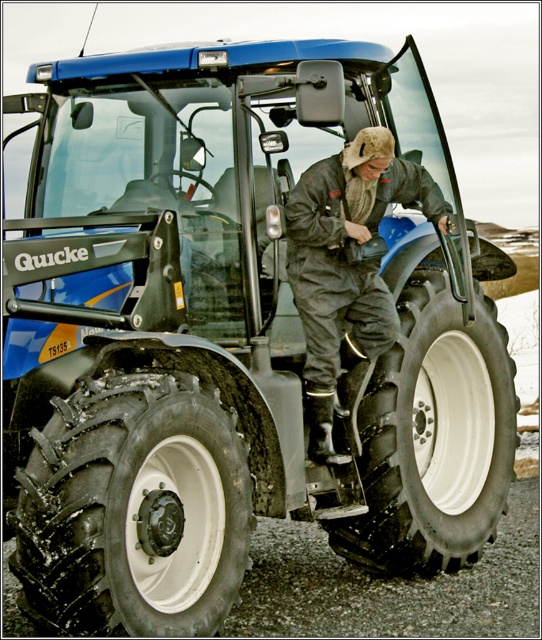
Consider the image. Who is lower down, black rubber tire at lower left or dark gray/leather jacket at center?

black rubber tire at lower left is lower down.

Which of these two, black rubber tire at lower left or dark gray/leather jacket at center, stands shorter?

black rubber tire at lower left is shorter.

Does point (229, 550) lie in front of point (340, 316)?

Yes.

Where is `black rubber tire at lower left`? This screenshot has height=640, width=542. black rubber tire at lower left is located at coordinates (133, 509).

Does black rubber tire at lower left have a smaller size compared to black rubber tire at lower center?

Yes, black rubber tire at lower left is smaller than black rubber tire at lower center.

Is black rubber tire at lower left below black rubber tire at lower center?

Yes.

Is point (119, 500) positioned before point (446, 508)?

That is True.

Identify the location of black rubber tire at lower left. The width and height of the screenshot is (542, 640). (133, 509).

Who is positioned more to the left, black rubber tire at lower center or dark gray/leather jacket at center?

dark gray/leather jacket at center

Between black rubber tire at lower center and dark gray/leather jacket at center, which one appears on the right side from the viewer's perspective?

From the viewer's perspective, black rubber tire at lower center appears more on the right side.

Find the location of a particular element. Image resolution: width=542 pixels, height=640 pixels. black rubber tire at lower center is located at coordinates (433, 436).

This screenshot has height=640, width=542. I want to click on black rubber tire at lower center, so (x=433, y=436).